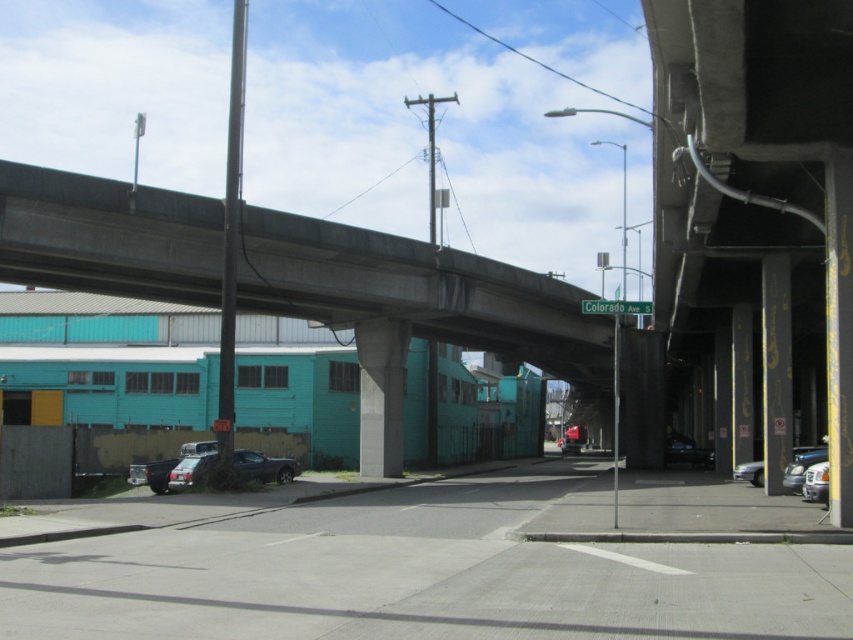
Question: Does satin black truck at lower left have a larger size compared to metallic silver car at center?

Choices:
 (A) yes
 (B) no

Answer: (B)

Question: Is shiny black sedan at center above metallic silver car at center?

Choices:
 (A) no
 (B) yes

Answer: (B)

Question: Is concrete bridge at upper center above silver metallic sedan at lower right?

Choices:
 (A) no
 (B) yes

Answer: (B)

Question: Which object is the closest to the shiny black sedan at center?

Choices:
 (A) silver metallic car at lower right
 (B) silver metallic sedan at lower right
 (C) concrete bridge at upper center

Answer: (C)

Question: Among these points, which one is nearest to the camera?

Choices:
 (A) (817, 477)
 (B) (164, 465)
 (C) (695, 460)

Answer: (A)

Question: Which object is the farthest from the silver metallic car at lower right?

Choices:
 (A) shiny black sedan at center
 (B) metallic silver car at center
 (C) silver metallic sedan at lower right

Answer: (B)